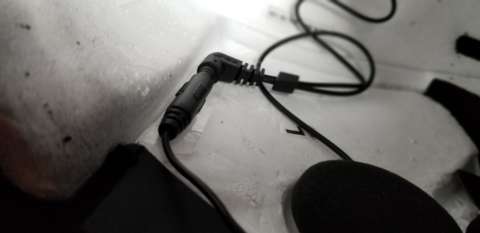
You are a GUI agent. You are given a task and a screenshot of the screen. Output one action in this format:
    pyautogui.click(x=<x>, y=<y>)
    Task: Click on the rightmost wall
    Image resolution: width=480 pixels, height=233 pixels.
    Given the screenshot: What is the action you would take?
    pyautogui.click(x=416, y=29)